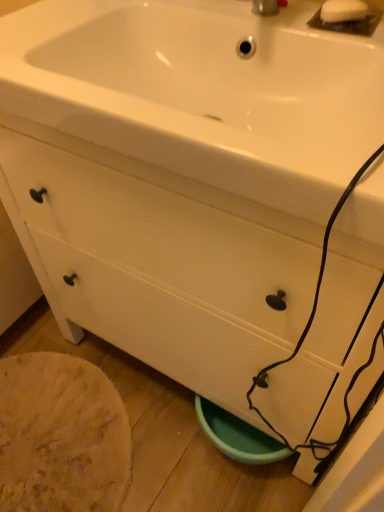
Question: From the image's perspective, would you say white glossy sink at upper center is positioned over white matte drawer at lower center?

Choices:
 (A) yes
 (B) no

Answer: (A)

Question: Is white glossy sink at upper center oriented away from white matte drawer at lower center?

Choices:
 (A) yes
 (B) no

Answer: (B)

Question: Is white glossy sink at upper center at the left side of white matte drawer at lower center?

Choices:
 (A) yes
 (B) no

Answer: (B)

Question: From a real-world perspective, does white glossy sink at upper center sit lower than white matte drawer at lower center?

Choices:
 (A) yes
 (B) no

Answer: (B)

Question: Considering the relative sizes of white glossy sink at upper center and white matte drawer at lower center in the image provided, is white glossy sink at upper center thinner than white matte drawer at lower center?

Choices:
 (A) yes
 (B) no

Answer: (A)

Question: From a real-world perspective, is white glossy sink at upper center over white matte drawer at lower center?

Choices:
 (A) no
 (B) yes

Answer: (B)

Question: From the image's perspective, is white glossy sink at upper center beneath white matte soap at upper right?

Choices:
 (A) no
 (B) yes

Answer: (B)

Question: Can you confirm if white glossy sink at upper center is positioned to the left of white matte soap at upper right?

Choices:
 (A) yes
 (B) no

Answer: (A)

Question: Is white glossy sink at upper center at the right side of white matte soap at upper right?

Choices:
 (A) yes
 (B) no

Answer: (B)

Question: Are white glossy sink at upper center and white matte soap at upper right beside each other?

Choices:
 (A) yes
 (B) no

Answer: (B)

Question: From a real-world perspective, is white glossy sink at upper center on white matte soap at upper right?

Choices:
 (A) no
 (B) yes

Answer: (A)

Question: Can you confirm if white glossy sink at upper center is taller than white matte soap at upper right?

Choices:
 (A) no
 (B) yes

Answer: (B)

Question: From the image's perspective, is white matte soap at upper right under white matte drawer at lower center?

Choices:
 (A) yes
 (B) no

Answer: (B)